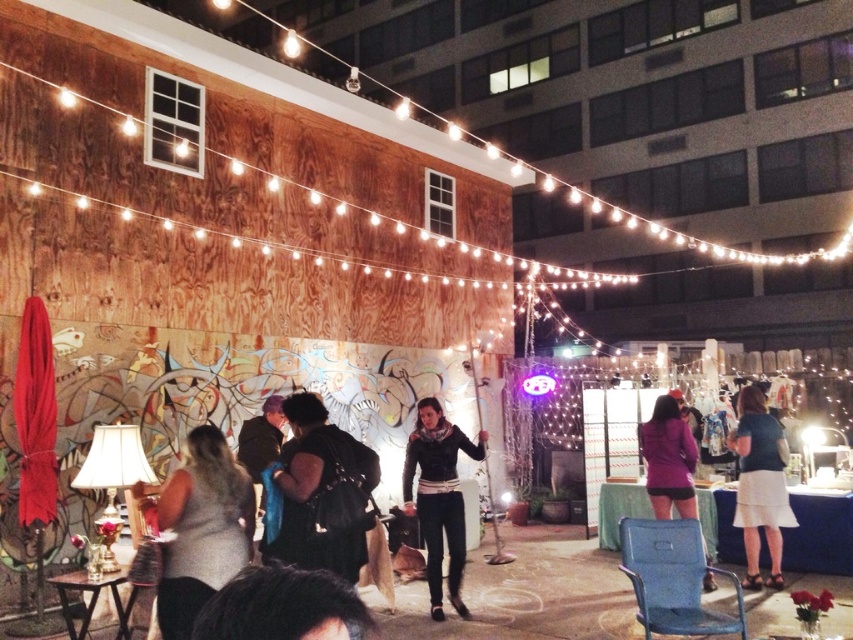
Is the position of teal fabric skirt at right less distant than that of purple matte jacket at center?

Yes, it is.

Who is shorter, teal fabric skirt at right or purple matte jacket at center?

purple matte jacket at center is shorter.

Where is `teal fabric skirt at right`? This screenshot has width=853, height=640. teal fabric skirt at right is located at coordinates [x=759, y=484].

Which of these two, black matte jacket at center or dark brown hair at lower center, stands shorter?

dark brown hair at lower center is shorter.

Based on the photo, between black matte jacket at center and dark brown hair at lower center, which one is positioned lower?

black matte jacket at center is below.

Locate an element on the screen. The image size is (853, 640). black matte jacket at center is located at coordinates (322, 492).

The height and width of the screenshot is (640, 853). Identify the location of black matte jacket at center. (322, 492).

Which of these two, dark brown hair at lower center or purple matte jacket at center, stands shorter?

dark brown hair at lower center

Does dark brown hair at lower center appear over purple matte jacket at center?

Yes, dark brown hair at lower center is above purple matte jacket at center.

Identify the location of dark brown hair at lower center. (283, 608).

The height and width of the screenshot is (640, 853). In order to click on dark brown hair at lower center in this screenshot , I will do `click(283, 608)`.